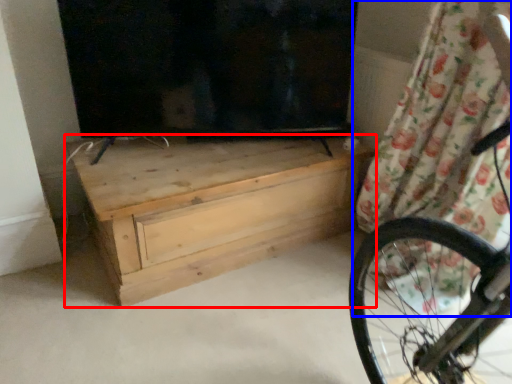
Question: Which of the following is the closest to the observer, chest of drawers (highlighted by a red box) or curtain (highlighted by a blue box)?

Choices:
 (A) chest of drawers
 (B) curtain

Answer: (B)